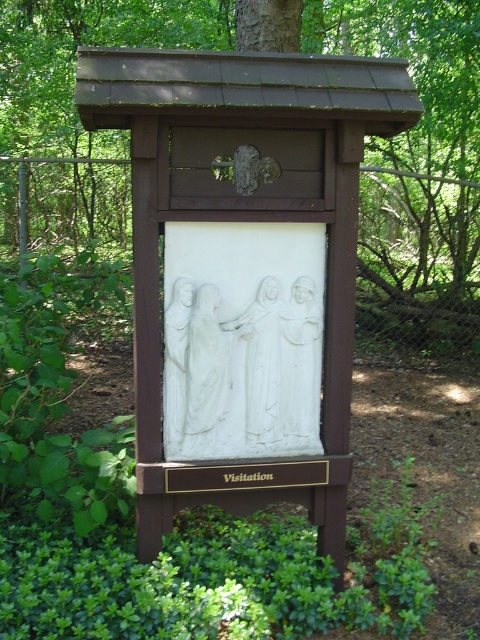
Between white stone relief at center and white marble statue at center, which one has more height?

white stone relief at center is taller.

From the picture: Who is positioned more to the right, white stone relief at center or white marble statue at center?

white marble statue at center

Locate an element on the screen. This screenshot has height=640, width=480. white stone relief at center is located at coordinates click(x=240, y=372).

Does brown wood tree at center come in front of white marble statue at center?

No.

Is brown wood tree at center taller than white marble statue at center?

Yes, brown wood tree at center is taller than white marble statue at center.

What do you see at coordinates (74, 61) in the screenshot? I see `brown wood tree at center` at bounding box center [74, 61].

At what (x,y) coordinates should I click in order to perform the action: click on brown wood tree at center. Please return your answer as a coordinate pair (x, y). This screenshot has height=640, width=480. Looking at the image, I should click on (74, 61).

From the picture: Which is below, brown wood tree at center or white stone relief at center?

white stone relief at center is below.

Between point (471, 246) and point (224, 420), which one is positioned in front?

Point (224, 420) is in front.

Which is behind, point (344, 26) or point (183, 392)?

The point (344, 26) is more distant.

You are a GUI agent. You are given a task and a screenshot of the screen. Output one action in this format:
    pyautogui.click(x=<x>, y=<y>)
    Task: Click on the brown wood tree at center
    The image size is (480, 640).
    Given the screenshot: What is the action you would take?
    coord(74,61)